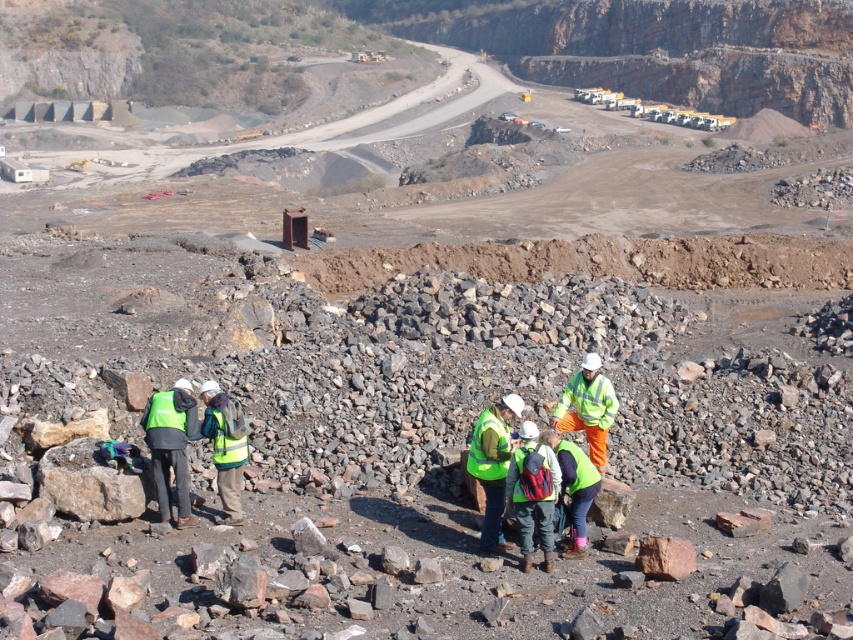
Does point (218, 477) come closer to viewer compared to point (228, 440)?

That is False.

Image resolution: width=853 pixels, height=640 pixels. Describe the element at coordinates (223, 451) in the screenshot. I see `green reflective vest at center` at that location.

This screenshot has height=640, width=853. Identify the location of green reflective vest at center. (223, 451).

Does high-visibility fabric safety vest at center-right have a lesser width compared to high visibility fabric safety vest at center?

No.

Is high-visibility fabric safety vest at center-right bigger than high visibility fabric safety vest at center?

Yes, high-visibility fabric safety vest at center-right is bigger than high visibility fabric safety vest at center.

Image resolution: width=853 pixels, height=640 pixels. What do you see at coordinates (589, 401) in the screenshot? I see `high-visibility fabric safety vest at center-right` at bounding box center [589, 401].

Locate an element on the screen. high-visibility fabric safety vest at center-right is located at coordinates (589, 401).

Is high visibility yellow vest at center closer to the viewer compared to green matte safety vest at lower left?

Yes, it is in front of green matte safety vest at lower left.

Between point (511, 449) and point (158, 419), which one is positioned behind?

Point (158, 419)

Where is `high visibility yellow vest at center`? high visibility yellow vest at center is located at coordinates (492, 465).